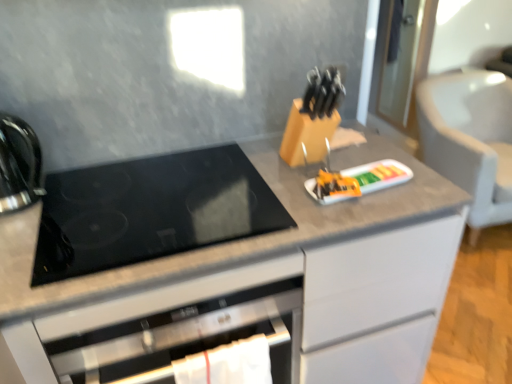
Question: Is orange plastic tray at center wider or thinner than shiny black kettle at left?

Choices:
 (A) wide
 (B) thin

Answer: (B)

Question: From their relative heights in the image, would you say orange plastic tray at center is taller or shorter than shiny black kettle at left?

Choices:
 (A) tall
 (B) short

Answer: (B)

Question: Which of these objects is positioned farthest from the gray fabric armchair at right?

Choices:
 (A) wooden cabinet at center
 (B) shiny black kettle at left
 (C) orange plastic tray at center
 (D) black glass cooktop at center

Answer: (B)

Question: Which is nearer to the black glass cooktop at center?

Choices:
 (A) orange plastic tray at center
 (B) wooden cabinet at center
 (C) gray fabric armchair at right
 (D) shiny black kettle at left

Answer: (B)